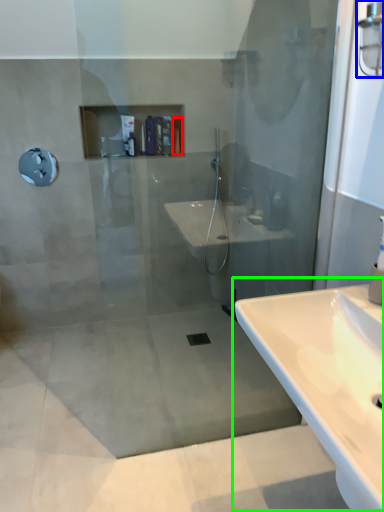
Question: Which object is the farthest from toiletry (highlighted by a red box)? Choose among these: light fixture (highlighted by a blue box) or sink (highlighted by a green box).

Choices:
 (A) light fixture
 (B) sink

Answer: (B)